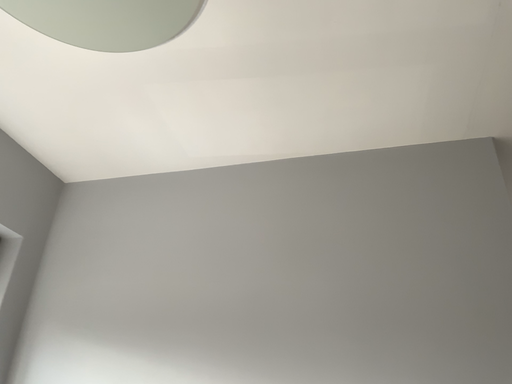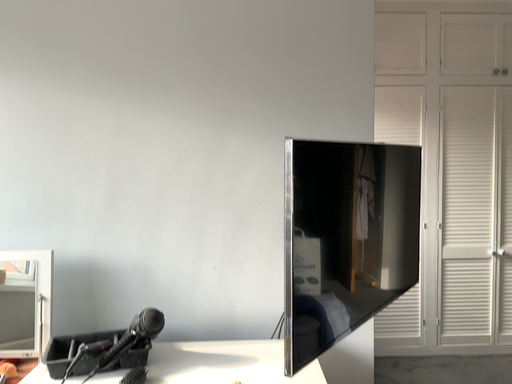
Question: How did the camera likely rotate when shooting the video?

Choices:
 (A) rotated upward
 (B) rotated downward

Answer: (B)